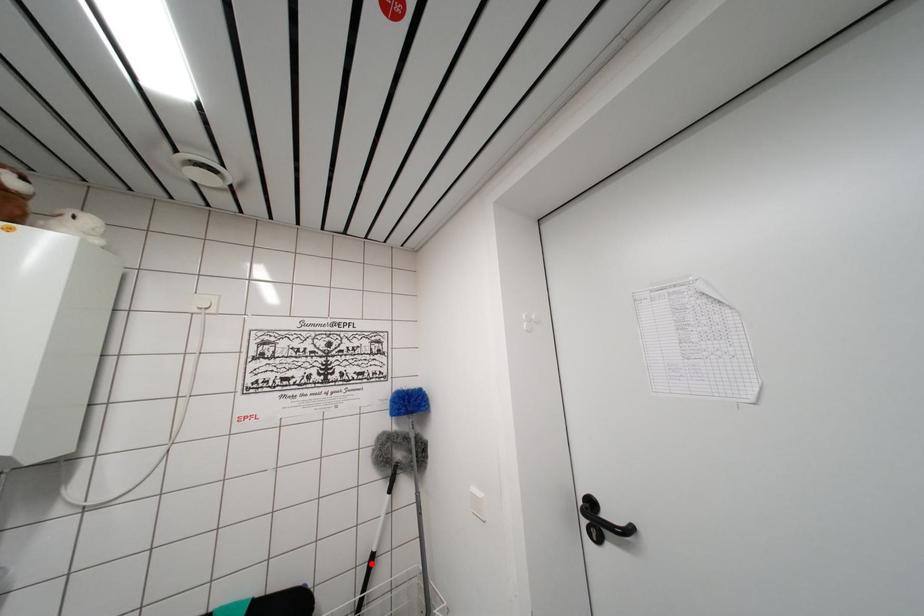
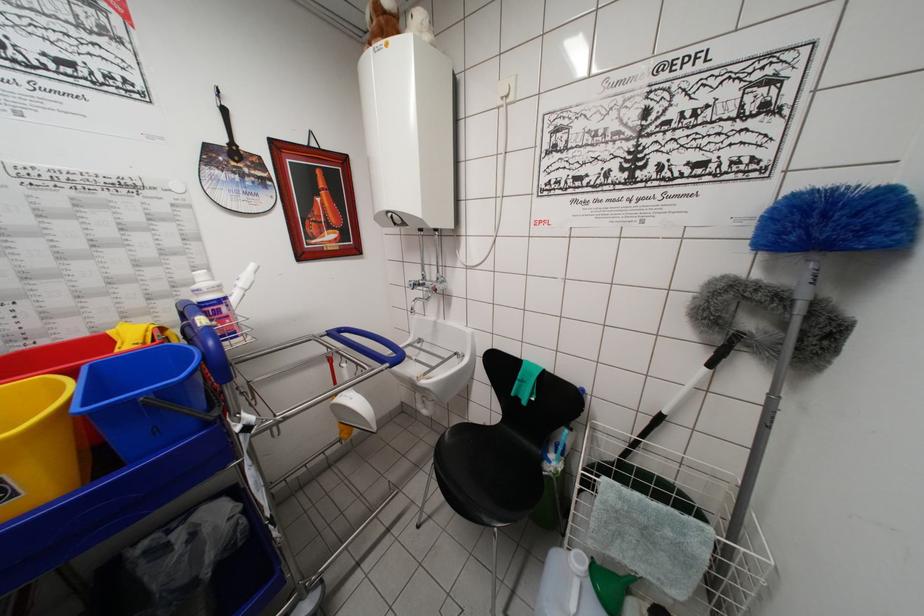
In the second image, find the point that corresponds to the highlighted location in the first image.

(658, 419)